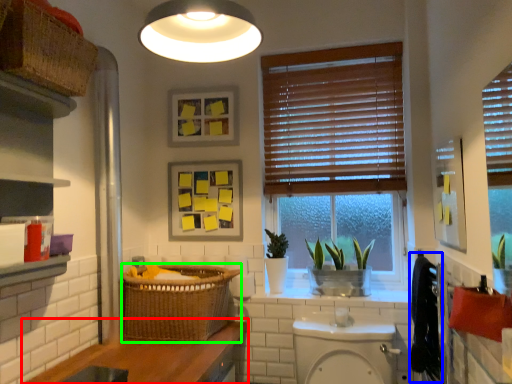
Question: Estimate the real-world distances between objects in this image. Which object is closer to counter top (highlighted by a red box), laundry (highlighted by a blue box) or basket (highlighted by a green box)?

Choices:
 (A) laundry
 (B) basket

Answer: (B)